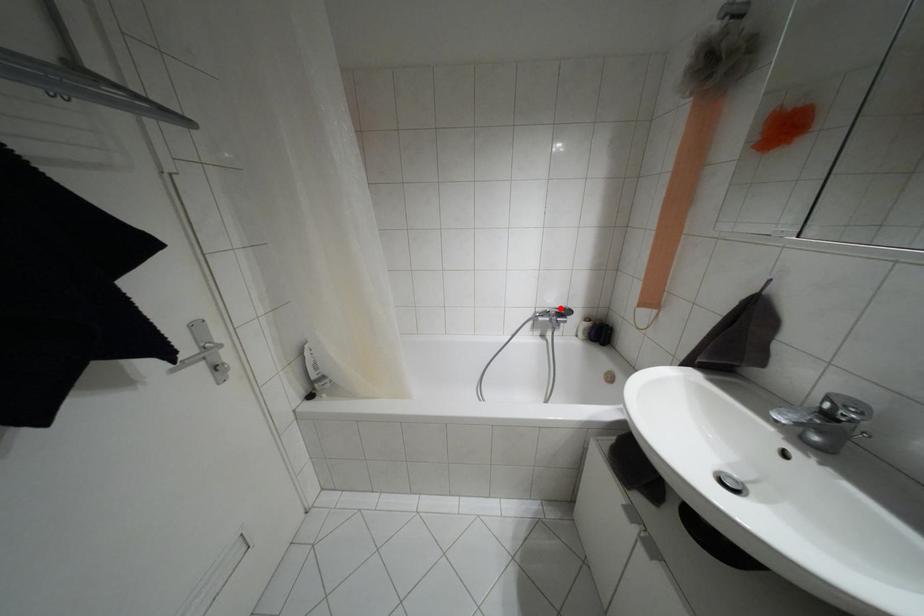
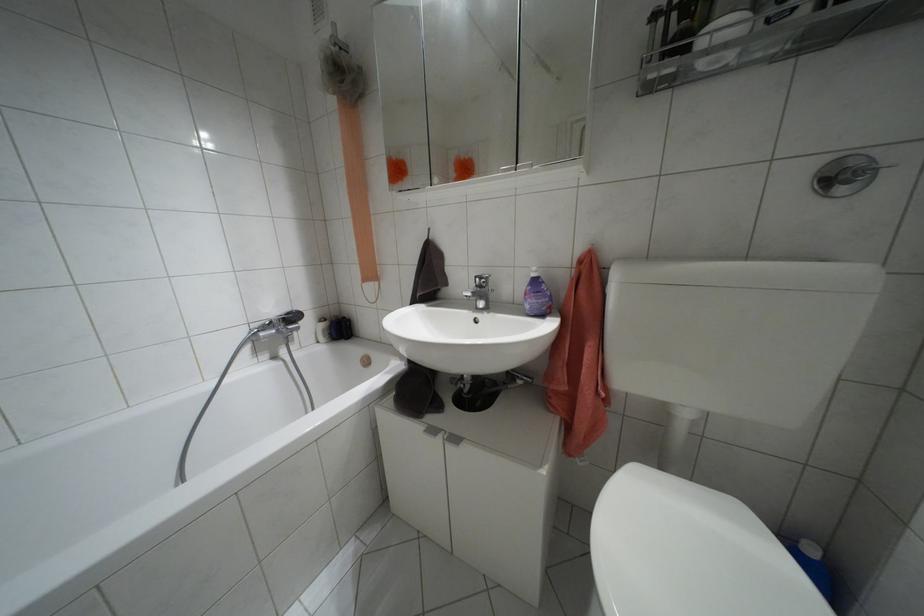
The point at the highlighted location is marked in the first image. Where is the corresponding point in the second image?

(286, 313)